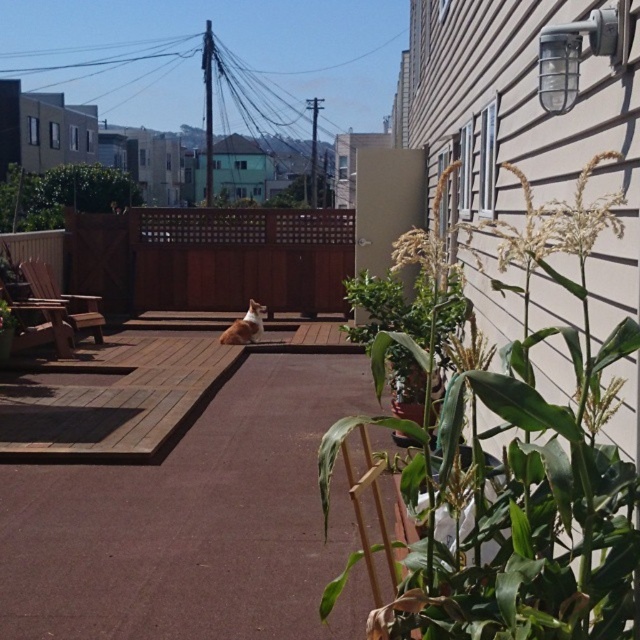
Can you confirm if brown wooden deck at center is shorter than white fur cat at center?

Yes.

Can you confirm if brown wooden deck at center is thinner than white fur cat at center?

No, brown wooden deck at center is not thinner than white fur cat at center.

Identify the location of brown wooden deck at center. The image size is (640, 640). (182, 506).

Locate an element on the screen. Image resolution: width=640 pixels, height=640 pixels. brown wooden deck at center is located at coordinates (182, 506).

Can you confirm if green leafy plant at right is positioned above white fur cat at center?

Actually, green leafy plant at right is below white fur cat at center.

Is point (388, 422) farther from camera compared to point (252, 333)?

No, (388, 422) is in front of (252, 333).

Find the location of a particular element. Image resolution: width=640 pixels, height=640 pixels. green leafy plant at right is located at coordinates (506, 465).

Between brown wooden deck at center and green leafy plant at right, which one has less height?

brown wooden deck at center is shorter.

Is brown wooden deck at center further to the viewer compared to green leafy plant at right?

Yes, brown wooden deck at center is further from the viewer.

Identify the location of brown wooden deck at center. (182, 506).